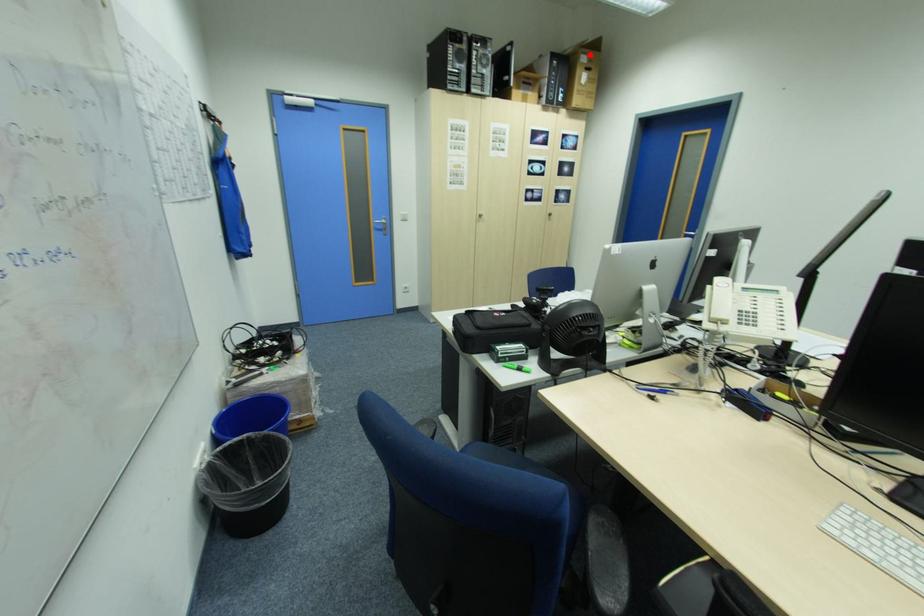
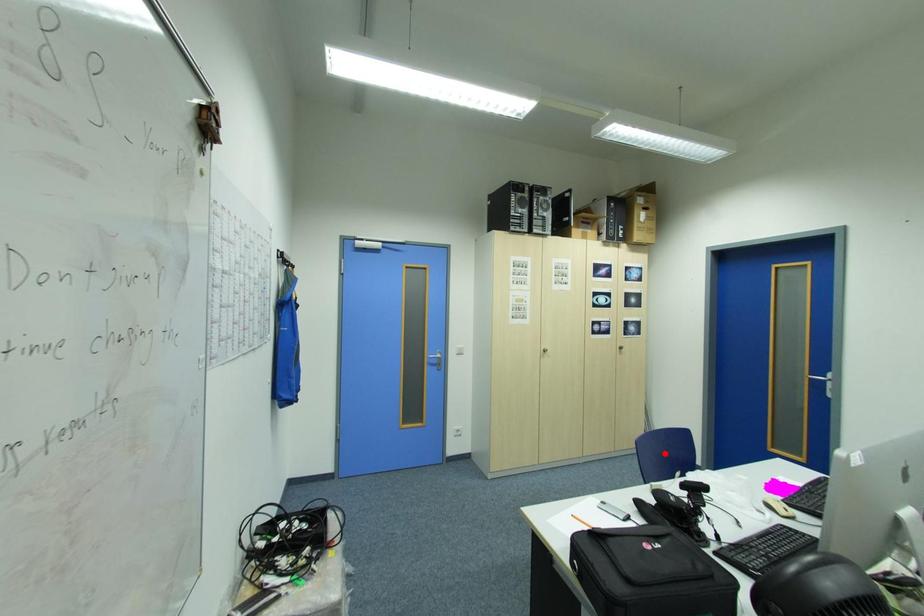
I am providing you with two images of the same scene from different viewpoints. A red point is marked on the first image and another point is marked on the second image. Is the marked point in image1 the same physical position as the marked point in image2?

No